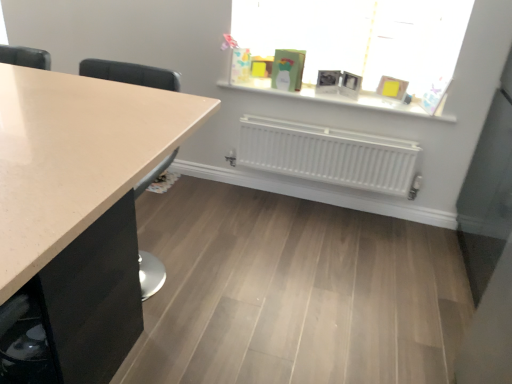
The image size is (512, 384). What are the coordinates of `matte beige countertop at left` in the screenshot? It's located at (75, 156).

What do you see at coordinates (328, 155) in the screenshot? I see `white matte radiator at center` at bounding box center [328, 155].

The image size is (512, 384). Identify the location of white matte radiator at center. (328, 155).

Identify the location of matte glass window at upper center. (362, 44).

Could you tell me if white matte radiator at center is facing matte glass window at upper center?

No, white matte radiator at center is not oriented towards matte glass window at upper center.

Can you tell me how much white matte radiator at center and matte glass window at upper center differ in facing direction?

They differ by 1.39 degrees in their facing directions.

Does white matte radiator at center have a greater width compared to matte glass window at upper center?

Incorrect, the width of white matte radiator at center does not surpass that of matte glass window at upper center.

Could matte glass window at upper center be considered to be inside white matte radiator at center?

Actually, matte glass window at upper center is outside white matte radiator at center.

From the image's perspective, is matte beige countertop at left above or below white matte window sill at upper center?

matte beige countertop at left is below white matte window sill at upper center.

Is matte beige countertop at left oriented away from white matte window sill at upper center?

That's not correct — matte beige countertop at left is not looking away from white matte window sill at upper center.

Is matte beige countertop at left completely or partially outside of white matte window sill at upper center?

That's correct, matte beige countertop at left is outside of white matte window sill at upper center.

Is matte glass window at upper center inside matte beige countertop at left?

No, matte glass window at upper center is not surrounded by matte beige countertop at left.

Considering the relative positions of matte beige countertop at left and matte glass window at upper center in the image provided, is matte beige countertop at left to the left of matte glass window at upper center from the viewer's perspective?

Yes.

From a real-world perspective, who is located higher, matte beige countertop at left or matte glass window at upper center?

matte glass window at upper center.

Would you say white matte window sill at upper center is to the left or to the right of matte glass window at upper center in the picture?

From the image, it's evident that white matte window sill at upper center is to the left of matte glass window at upper center.

How many degrees apart are the facing directions of white matte window sill at upper center and matte glass window at upper center?

They differ by 1.39 degrees in their facing directions.

Is point (418, 114) closer to viewer compared to point (238, 17)?

Yes, it is in front of point (238, 17).

Is the surface of white matte window sill at upper center in direct contact with matte glass window at upper center?

white matte window sill at upper center and matte glass window at upper center are not in contact.

Which of these two, matte glass window at upper center or white matte window sill at upper center, stands shorter?

Standing shorter between the two is white matte window sill at upper center.

Is matte glass window at upper center in front of white matte window sill at upper center?

That is True.

From the image's perspective, which is below, matte glass window at upper center or white matte window sill at upper center?

white matte window sill at upper center.

Measure the distance from matte glass window at upper center to white matte window sill at upper center.

The distance of matte glass window at upper center from white matte window sill at upper center is 8.26 inches.

Can you confirm if matte glass window at upper center is bigger than white matte radiator at center?

Indeed, matte glass window at upper center has a larger size compared to white matte radiator at center.

From the image's perspective, is matte glass window at upper center below white matte radiator at center?

Actually, matte glass window at upper center appears above white matte radiator at center in the image.

Relative to white matte radiator at center, is matte glass window at upper center in front or behind?

Clearly, matte glass window at upper center is in front of white matte radiator at center.

From the image's perspective, which is below, white matte radiator at center or white matte window sill at upper center?

white matte radiator at center, from the image's perspective.

Looking at this image, is white matte radiator at center facing towards white matte window sill at upper center?

No, white matte radiator at center does not turn towards white matte window sill at upper center.

Considering the sizes of white matte radiator at center and white matte window sill at upper center in the image, is white matte radiator at center taller or shorter than white matte window sill at upper center?

Clearly, white matte radiator at center is taller compared to white matte window sill at upper center.

Does white matte radiator at center appear on the left side of white matte window sill at upper center?

Yes, white matte radiator at center is to the left of white matte window sill at upper center.

The height and width of the screenshot is (384, 512). In order to click on radiator lying below the matte glass window at upper center (from the image's perspective) in this screenshot , I will do `click(328, 155)`.

Locate an element on the screen. window sill that appears on the right of matte beige countertop at left is located at coordinates (343, 99).

When comparing their distances from matte glass window at upper center, does matte beige countertop at left or white matte radiator at center seem closer?

white matte radiator at center.

Which object lies nearer to the anchor point matte beige countertop at left, matte glass window at upper center or white matte radiator at center?

Among the two, white matte radiator at center is located nearer to matte beige countertop at left.

When comparing their distances from white matte window sill at upper center, does matte glass window at upper center or matte beige countertop at left seem closer?

matte glass window at upper center is positioned closer to the anchor white matte window sill at upper center.

When comparing their distances from matte beige countertop at left, does white matte radiator at center or matte glass window at upper center seem closer?

white matte radiator at center is positioned closer to the anchor matte beige countertop at left.

Considering their positions, is matte beige countertop at left positioned closer to white matte radiator at center than white matte window sill at upper center?

The object closer to white matte radiator at center is white matte window sill at upper center.

Based on their spatial positions, is white matte radiator at center or matte beige countertop at left closer to matte glass window at upper center?

Based on the image, white matte radiator at center appears to be nearer to matte glass window at upper center.

Looking at the image, which one is located further to matte beige countertop at left, white matte window sill at upper center or matte glass window at upper center?

white matte window sill at upper center is positioned further to the anchor matte beige countertop at left.

When comparing their distances from matte glass window at upper center, does white matte window sill at upper center or matte beige countertop at left seem further?

Among the two, matte beige countertop at left is located further to matte glass window at upper center.

The width and height of the screenshot is (512, 384). I want to click on radiator between matte beige countertop at left and matte glass window at upper center from left to right, so click(328, 155).

In order to click on window sill situated between matte beige countertop at left and matte glass window at upper center from left to right in this screenshot , I will do `click(343, 99)`.

Where is `radiator located between matte beige countertop at left and white matte window sill at upper center in the left-right direction`? The width and height of the screenshot is (512, 384). radiator located between matte beige countertop at left and white matte window sill at upper center in the left-right direction is located at coordinates (328, 155).

Locate an element on the screen. window sill between matte glass window at upper center and white matte radiator at center in the up-down direction is located at coordinates (343, 99).